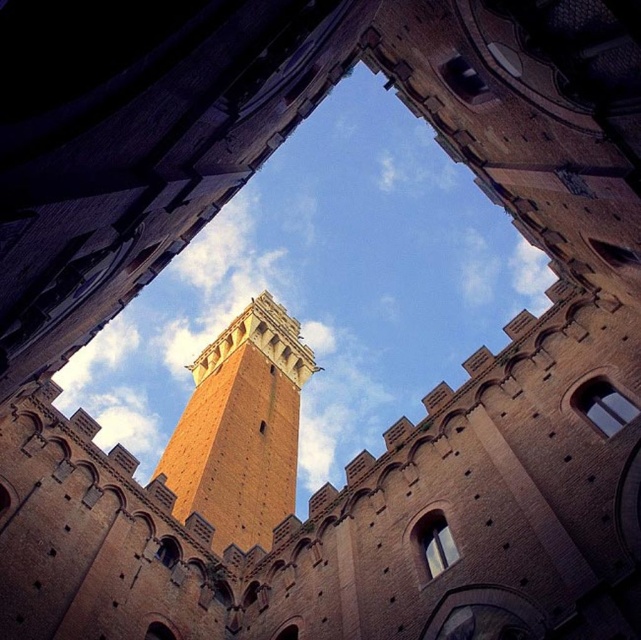
You are standing at the base of the brick tower at center and want to look through the matte glass window at center. Can you see the window clearly from your current position?

The matte glass window at center is behind the brick tower at center, so you cannot see it clearly from your current position at the base of the brick tower at center.

Looking at this image, you are an architect examining this structure from the ground. You notice the brick tower at center and the matte glass window at center. Which object would cast a longer shadow during midday when the sun is directly overhead?

The brick tower at center has a larger size compared to the matte glass window at center, so it would cast a longer shadow during midday when the sun is directly overhead.

You are standing at the base of the tower and looking up. You want to know where the matte glass window at center is located. Can you tell me its coordinates?

The matte glass window at center is located at coordinates point (603, 404).